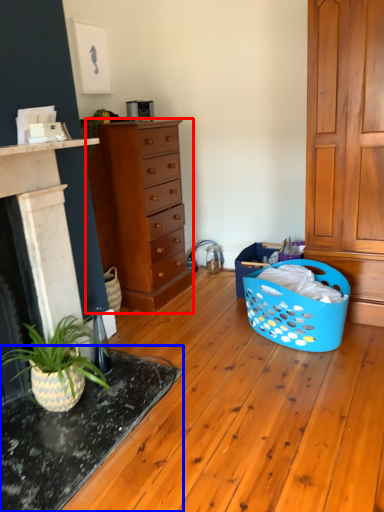
Question: Which point is closer to the camera, chest of drawers (highlighted by a red box) or table (highlighted by a blue box)?

Choices:
 (A) chest of drawers
 (B) table

Answer: (B)